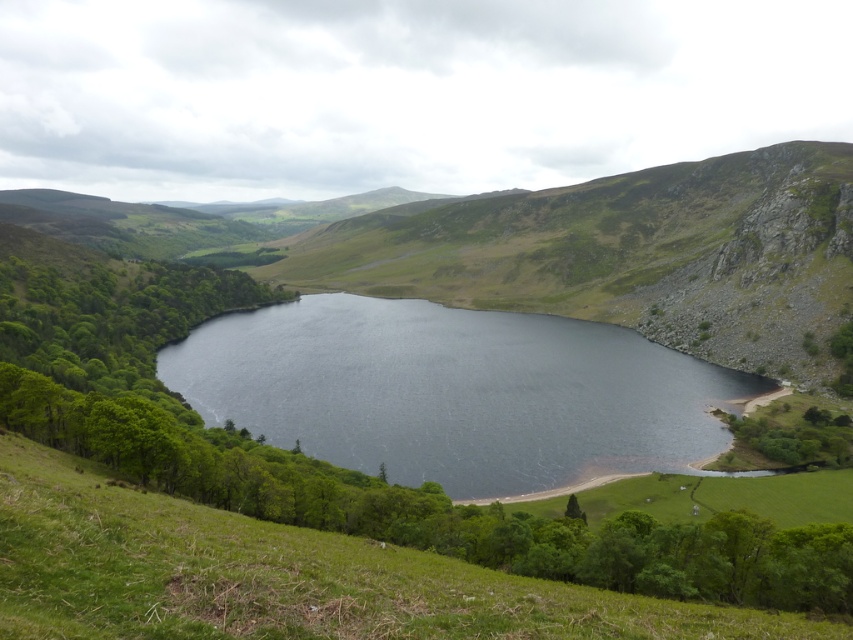
Question: From the image, what is the correct spatial relationship of dark blue water at center in relation to green grassy hillside at lower center?

Choices:
 (A) below
 (B) above

Answer: (B)

Question: Which point is farther from the camera taking this photo?

Choices:
 (A) (0, 445)
 (B) (436, 326)

Answer: (B)

Question: Which of the following is the closest to the observer?

Choices:
 (A) coord(172,387)
 (B) coord(589,604)

Answer: (B)

Question: Is dark blue water at center below green grassy hillside at lower center?

Choices:
 (A) no
 (B) yes

Answer: (A)

Question: Is dark blue water at center to the left of green grassy hillside at lower center from the viewer's perspective?

Choices:
 (A) no
 (B) yes

Answer: (A)